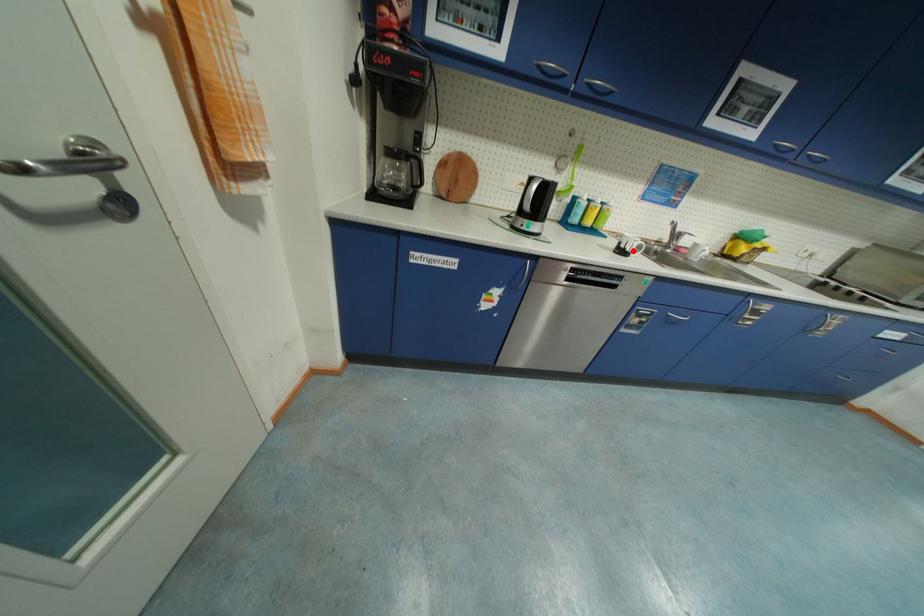
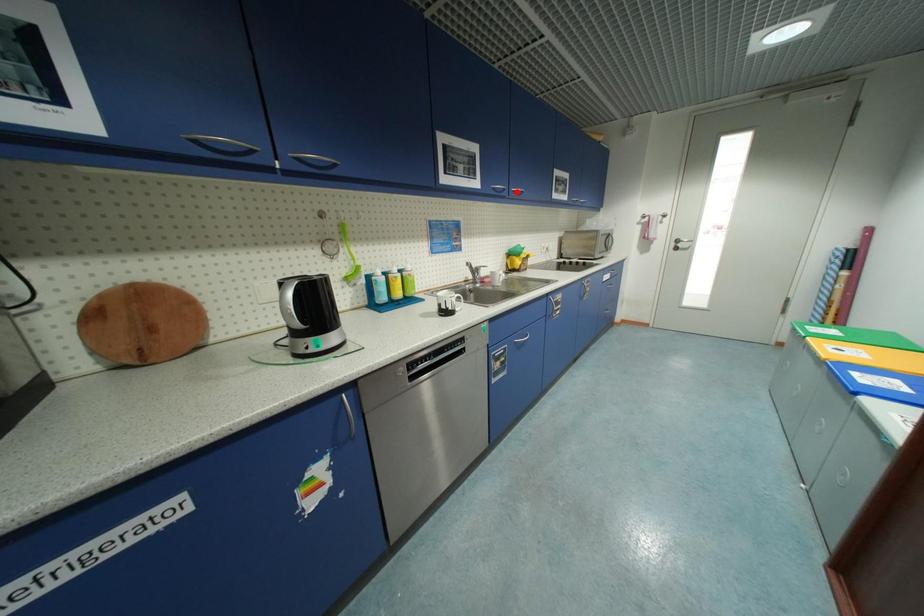
I am providing you with two images of the same scene from different viewpoints. A red point is marked on the first image and another point is marked on the second image. Are the points marked in image1 and image2 representing the same 3D position?

No